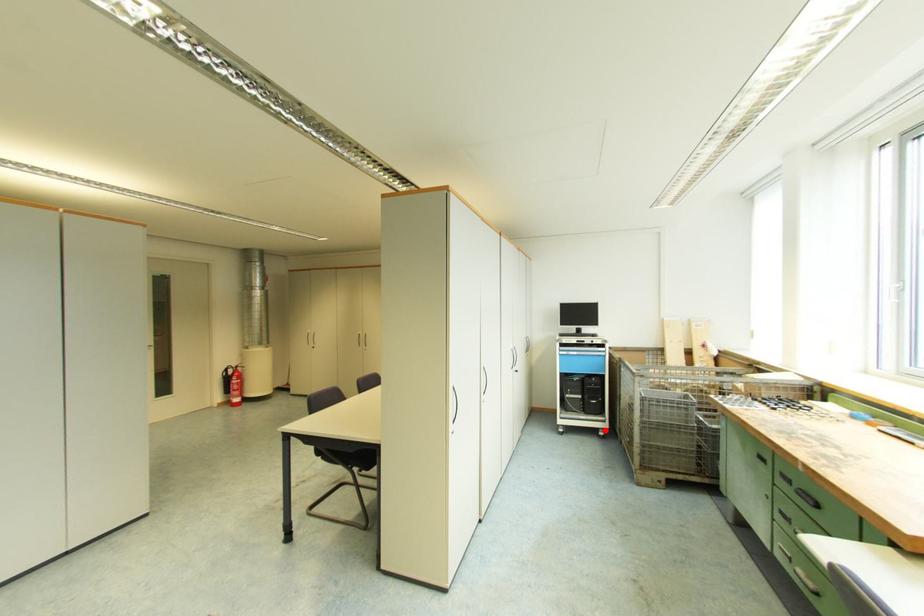
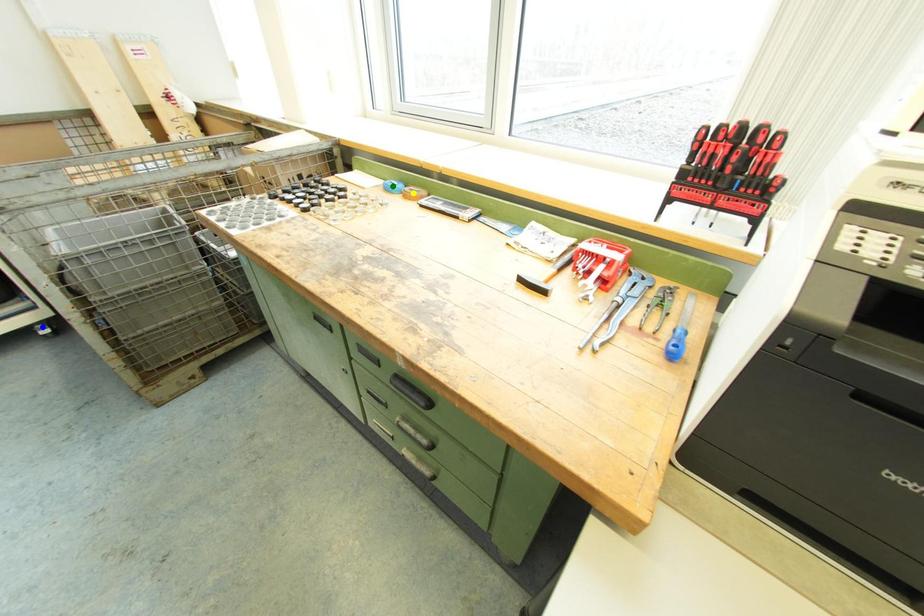
Question: I am providing you with two images of the same scene from different viewpoints. A red point is marked on the first image. You are given multiple points on the second image. Which point in image 2 represents the same 3d spot as the red point in image 1?

Choices:
 (A) yellow point
 (B) blue point
 (C) green point

Answer: (B)